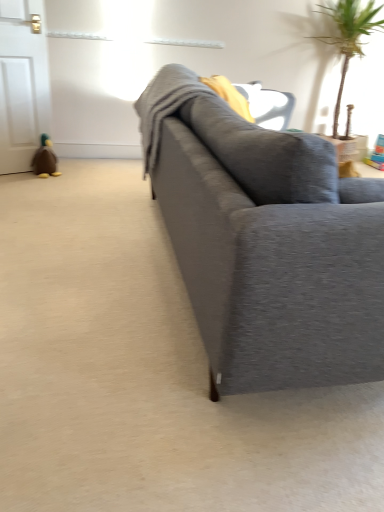
Question: Are green leafy plant at upper right and matte gray couch at center located far from each other?

Choices:
 (A) no
 (B) yes

Answer: (B)

Question: From the image's perspective, is green leafy plant at upper right beneath matte gray couch at center?

Choices:
 (A) no
 (B) yes

Answer: (A)

Question: From a real-world perspective, is green leafy plant at upper right under matte gray couch at center?

Choices:
 (A) no
 (B) yes

Answer: (A)

Question: From a real-world perspective, is green leafy plant at upper right on top of matte gray couch at center?

Choices:
 (A) no
 (B) yes

Answer: (B)

Question: Can you confirm if green leafy plant at upper right is positioned to the left of matte gray couch at center?

Choices:
 (A) no
 (B) yes

Answer: (A)

Question: Is green leafy plant at upper right taller than matte gray couch at center?

Choices:
 (A) no
 (B) yes

Answer: (B)

Question: From the image's perspective, would you say matte gray couch at center is shown under green leafy plant at upper right?

Choices:
 (A) no
 (B) yes

Answer: (B)

Question: Does matte gray couch at center have a smaller size compared to green leafy plant at upper right?

Choices:
 (A) yes
 (B) no

Answer: (B)

Question: Considering the relative sizes of matte gray couch at center and green leafy plant at upper right in the image provided, is matte gray couch at center bigger than green leafy plant at upper right?

Choices:
 (A) no
 (B) yes

Answer: (B)

Question: Does matte gray couch at center have a lesser width compared to green leafy plant at upper right?

Choices:
 (A) yes
 (B) no

Answer: (B)

Question: Does matte gray couch at center lie in front of green leafy plant at upper right?

Choices:
 (A) no
 (B) yes

Answer: (B)

Question: From a real-world perspective, does matte gray couch at center stand above green leafy plant at upper right?

Choices:
 (A) no
 (B) yes

Answer: (A)

Question: Can you confirm if matte gray couch at center is bigger than brown plush duck at left?

Choices:
 (A) yes
 (B) no

Answer: (A)